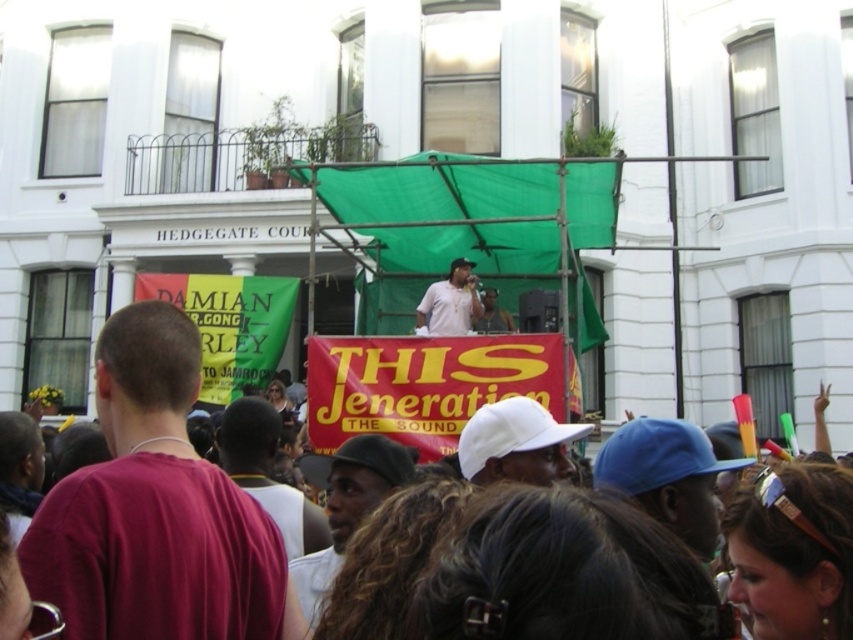
You are a photographer at the event and want to capture a clear photo of both the white matte baseball cap at center and the matte white shirt at center. Since you want to focus on the thinner object, which one should you adjust your camera settings for?

The white matte baseball cap at center is thinner than the matte white shirt at center, so you should adjust your camera settings to focus on the white matte baseball cap at center.

You are standing at the entrance of the building and want to locate the blue matte baseball cap at center. Based on the 2D coordinates provided, in which direction should you look relative to your current position?

The blue matte baseball cap at center is located at coordinates point [666,476], which is to the lower right direction from your current position at the entrance.